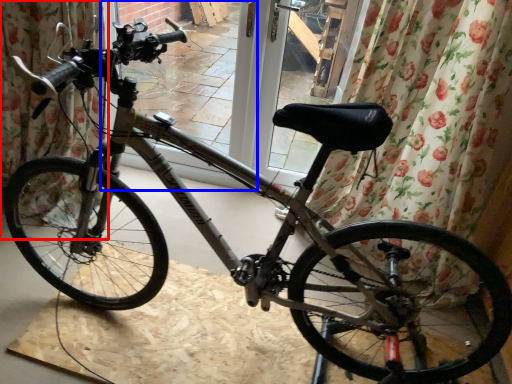
Question: Among these objects, which one is nearest to the camera, curtain (highlighted by a red box) or screen door (highlighted by a blue box)?

Choices:
 (A) curtain
 (B) screen door

Answer: (A)